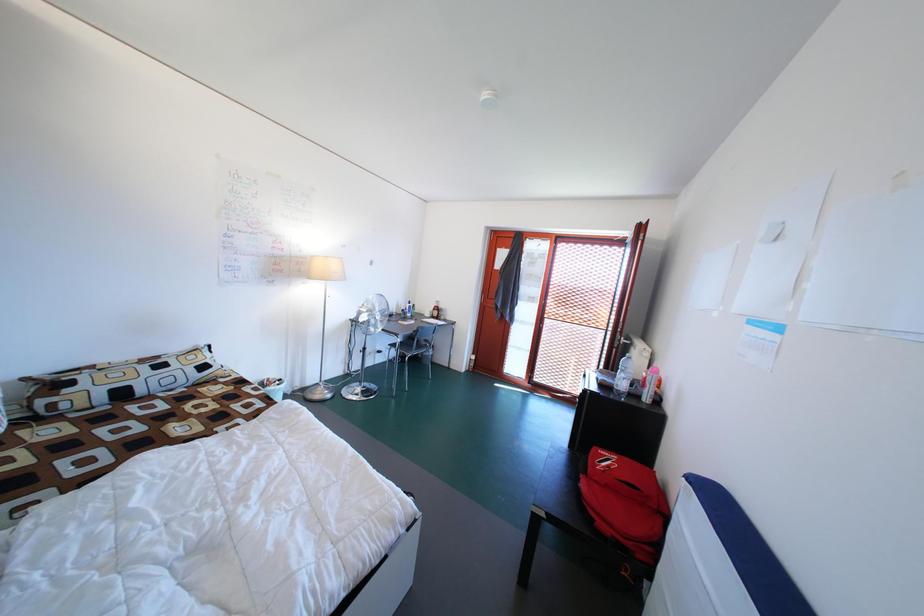
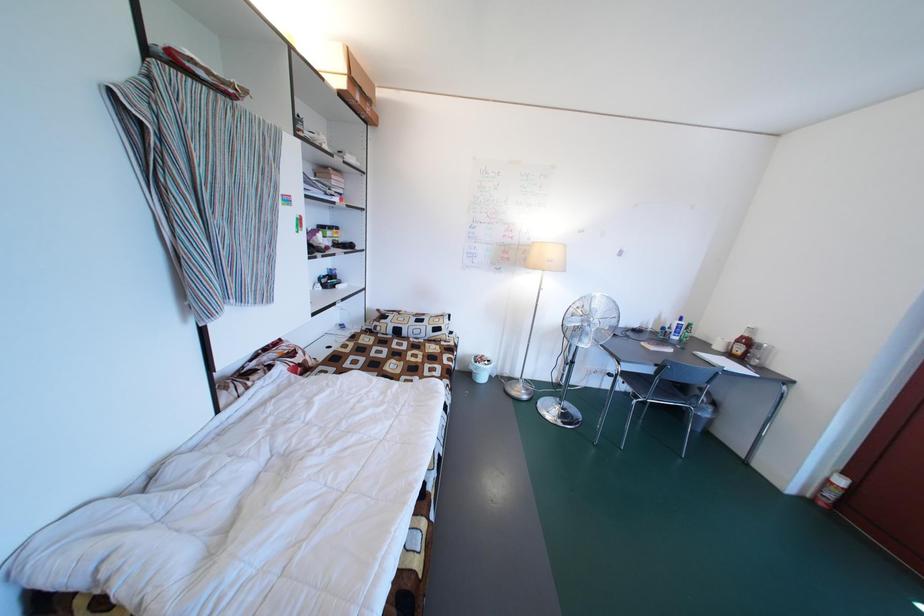
Question: The camera is either moving clockwise (left) or counter-clockwise (right) around the object. The first image is from the beginning of the video and the second image is from the end. Is the camera moving left or right when shooting the video?

Choices:
 (A) Left
 (B) Right

Answer: (B)